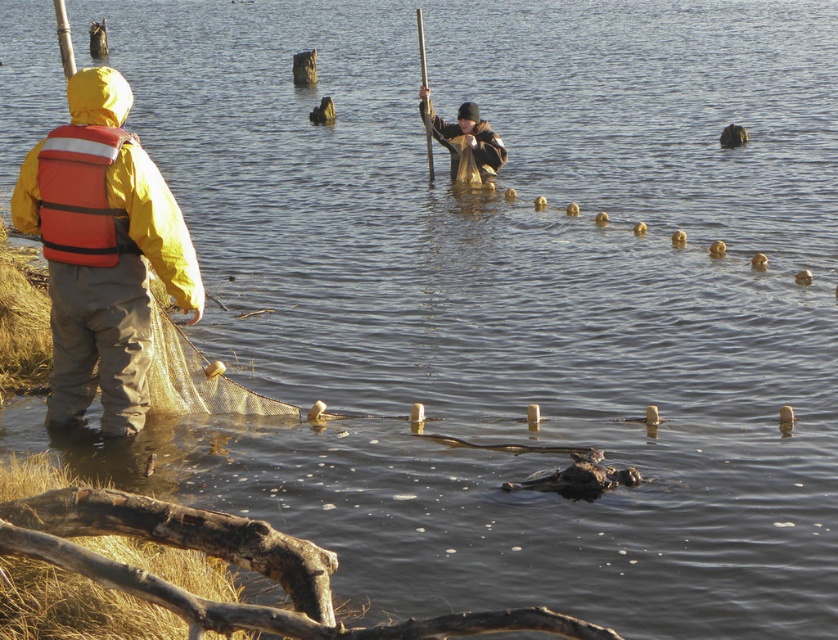
You are standing at the point marked as point (76, 132) in the marshy area. You need to reach a wooden post that is 10 meters away from you. Is the wooden post within your reach?

The distance between you and point (76, 132) is 7.48 meters. Since the wooden post is 10 meters away from you, it is beyond the distance of point (76, 132), so the wooden post is not within your immediate reach.

You are a safety inspector assessing the safety of the workers in the image. The safety guidelines state that the minimum safe distance between a life jacket and a mesh net should be at least 30 inches to prevent entanglement. Based on the scene, is the current distance between the orange fabric life jacket at left and the translucent mesh net at center compliant with the guidelines?

The distance between the orange fabric life jacket at left and the translucent mesh net at center is 28.02 inches, which is less than the required 30 inches. Therefore, the current setup does not comply with the safety guidelines to prevent entanglement.

You are a safety inspector assessing the scene. The orange fabric life jacket at left is required to be worn by the person in the water. Is the life jacket positioned correctly relative to the translucent mesh net at center according to safety protocols?

The orange fabric life jacket at left is in front of the translucent mesh net at center, which means it is positioned correctly as per safety protocols requiring the life jacket to be worn over the net to ensure proper buoyancy and visibility.